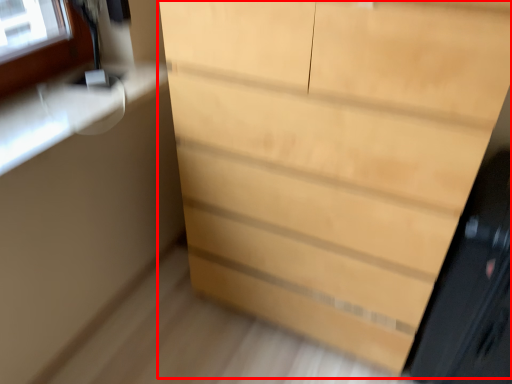
Question: Considering the relative positions of chest of drawers (annotated by the red box) and screen door in the image provided, where is chest of drawers (annotated by the red box) located with respect to the staircase?

Choices:
 (A) left
 (B) right

Answer: (A)